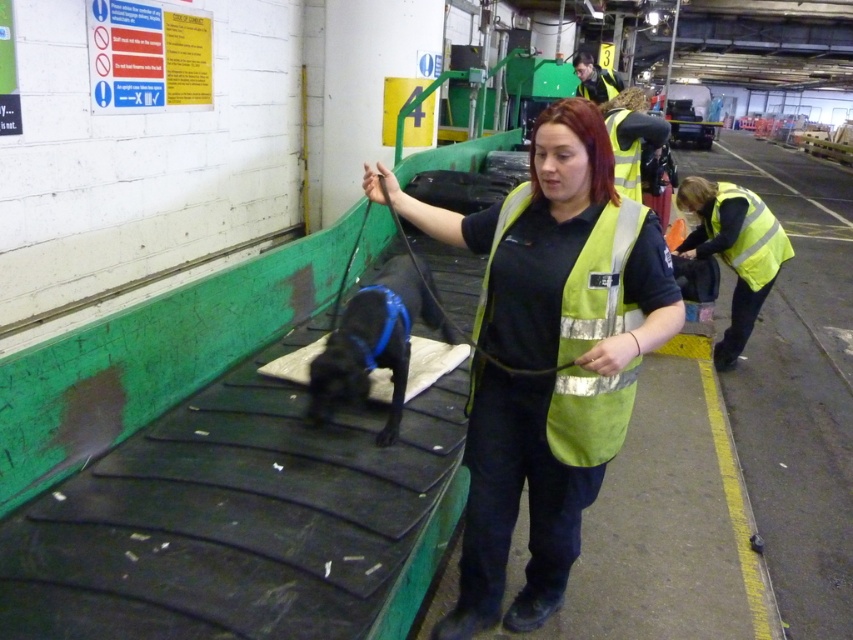
Question: Can you confirm if black leather dog at center is wider than yellow reflective safety vest at center?

Choices:
 (A) yes
 (B) no

Answer: (A)

Question: Which object appears farthest from the camera in this image?

Choices:
 (A) black leather dog at center
 (B) yellow reflective safety vest at right
 (C) high visibility fabric safety vest at center
 (D) reflective yellow vest at center

Answer: (B)

Question: Where is reflective yellow vest at center located in relation to yellow reflective safety vest at right in the image?

Choices:
 (A) below
 (B) above

Answer: (A)

Question: Which is nearer to the yellow reflective safety vest at center?

Choices:
 (A) reflective yellow vest at upper center
 (B) black leather dog at center

Answer: (B)

Question: Is reflective yellow vest at center smaller than yellow reflective safety vest at center?

Choices:
 (A) no
 (B) yes

Answer: (A)

Question: Among these points, which one is nearest to the camera?

Choices:
 (A) (614, 176)
 (B) (344, 307)

Answer: (A)